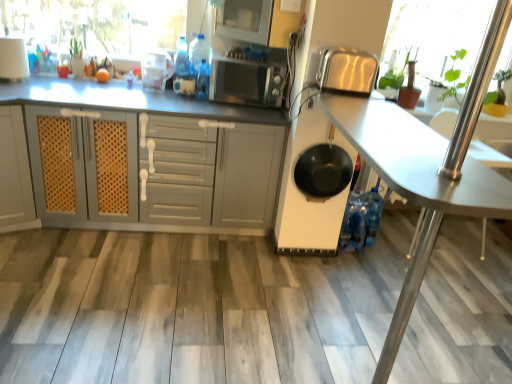
Question: From the image's perspective, does transparent glass window screen at upper left, which appears as the 2th window screen when viewed from the right, appear lower than black matte frying pan at center?

Choices:
 (A) no
 (B) yes

Answer: (A)

Question: From a real-world perspective, is transparent glass window screen at upper left, which appears as the 2th window screen when viewed from the right, under black matte frying pan at center?

Choices:
 (A) no
 (B) yes

Answer: (A)

Question: Does transparent glass window screen at upper left, the first window screen positioned from the left, have a greater height compared to black matte frying pan at center?

Choices:
 (A) no
 (B) yes

Answer: (A)

Question: Does transparent glass window screen at upper left, which appears as the 2th window screen when viewed from the right, come in front of black matte frying pan at center?

Choices:
 (A) no
 (B) yes

Answer: (A)

Question: Would you say black matte frying pan at center is part of transparent glass window screen at upper left, the first window screen positioned from the left,'s contents?

Choices:
 (A) yes
 (B) no

Answer: (B)

Question: From their relative heights in the image, would you say transparent plastic container at upper center, which is the second appliance from right to left, is taller or shorter than white glossy lampshade at upper left, the third appliance positioned from the right?

Choices:
 (A) tall
 (B) short

Answer: (B)

Question: From a real-world perspective, is transparent plastic container at upper center, the 3th appliance when ordered from front to back, above or below white glossy lampshade at upper left, positioned as the 2th appliance in front-to-back order?

Choices:
 (A) below
 (B) above

Answer: (A)

Question: Considering the relative positions of transparent plastic container at upper center, the 3th appliance when ordered from front to back, and white glossy lampshade at upper left, the third appliance positioned from the right, in the image provided, is transparent plastic container at upper center, the 3th appliance when ordered from front to back, to the left or to the right of white glossy lampshade at upper left, the third appliance positioned from the right,?

Choices:
 (A) left
 (B) right

Answer: (B)

Question: In terms of width, does transparent plastic container at upper center, which is the 1th appliance in back-to-front order, look wider or thinner when compared to white glossy lampshade at upper left, marked as the 2th appliance in a back-to-front arrangement?

Choices:
 (A) wide
 (B) thin

Answer: (B)

Question: Considering the positions of white matte cabinet at center and metallic silver table at center in the image, is white matte cabinet at center bigger or smaller than metallic silver table at center?

Choices:
 (A) big
 (B) small

Answer: (A)

Question: From a real-world perspective, is white matte cabinet at center above or below metallic silver table at center?

Choices:
 (A) below
 (B) above

Answer: (A)

Question: Is white matte cabinet at center spatially inside metallic silver table at center, or outside of it?

Choices:
 (A) outside
 (B) inside

Answer: (A)

Question: Looking at their shapes, would you say white matte cabinet at center is wider or thinner than metallic silver table at center?

Choices:
 (A) wide
 (B) thin

Answer: (A)

Question: Would you say white matte cabinet at center is to the left or to the right of green leafy plant at upper right, positioned as the 1th window screen in right-to-left order, in the picture?

Choices:
 (A) left
 (B) right

Answer: (A)

Question: Is white matte cabinet at center in front of or behind green leafy plant at upper right, positioned as the 1th window screen in right-to-left order, in the image?

Choices:
 (A) front
 (B) behind

Answer: (A)